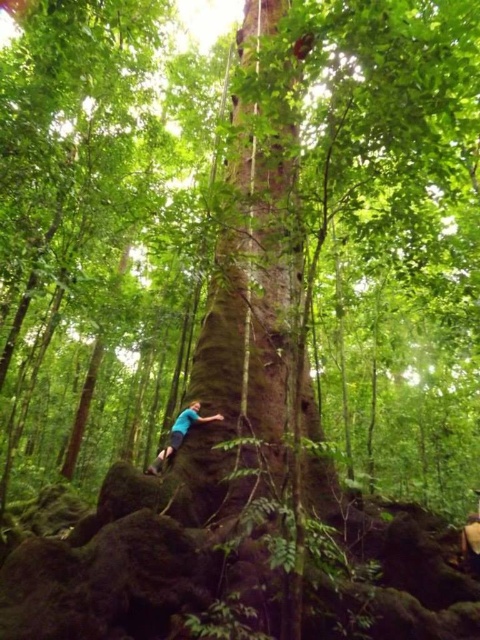
You are a hiker standing at the base of the smooth brown tree trunk at center. You notice your blue fabric shirt at lower center. Which object has a greater width when viewed from your current position?

The blue fabric shirt at lower center has a greater width than the smooth brown tree trunk at center.

You are standing in the forest looking up at the massive tree trunk. There are two points marked on the trunk at coordinates point (212,316) and point (214,417). Which point is closer to you?

Point (212,316) is further to the camera than point (214,417), so the point closer to you is point (214,417).

You are standing in a forest and looking up at the smooth brown tree trunk at center. You notice a blue fabric shirt at lower center. Which object is closer to your eyes?

The blue fabric shirt at lower center is closer to your eyes because it is positioned below the smooth brown tree trunk at center, which is above it.